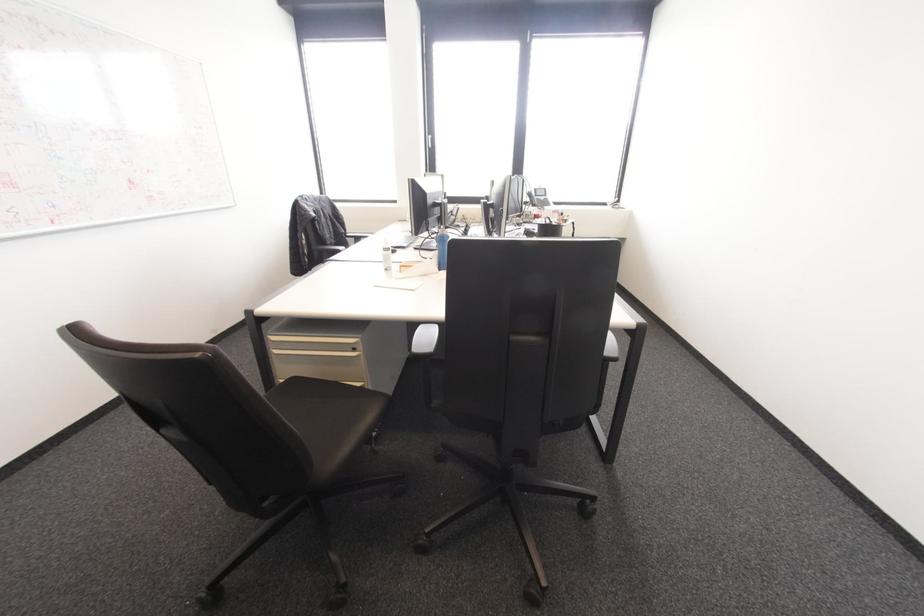
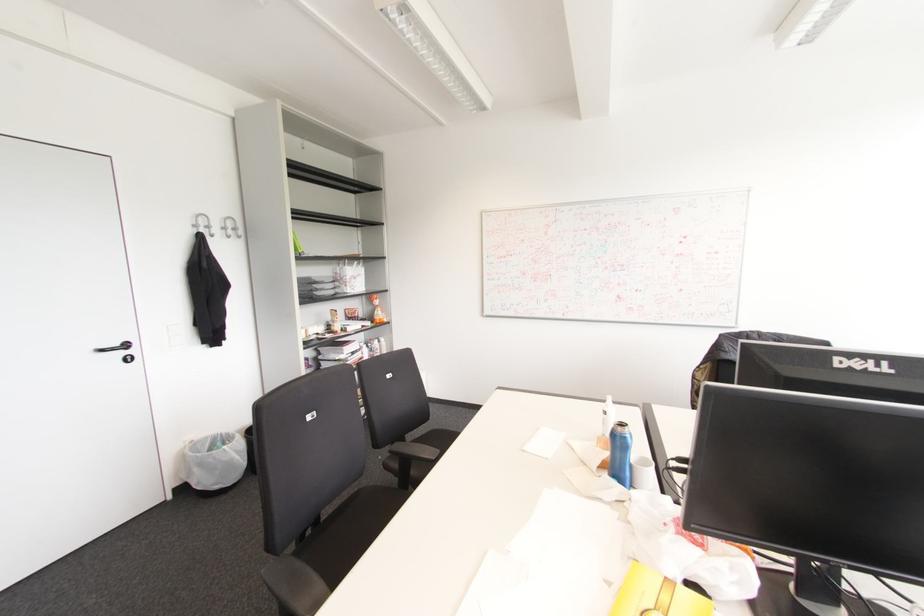
In the second image, find the point that corresponds to (440,270) in the first image.

(611, 479)